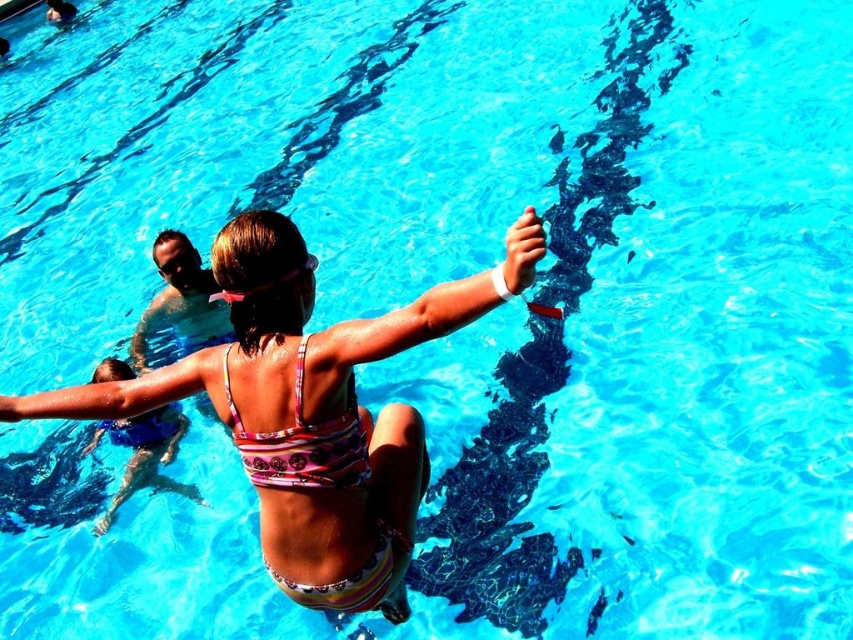
Is printed fabric bikini at center positioned at the back of printed fabric bikini top at center?

No, it is not.

Does printed fabric bikini at center appear on the left side of printed fabric bikini top at center?

In fact, printed fabric bikini at center is to the right of printed fabric bikini top at center.

Identify the location of printed fabric bikini at center. (305, 444).

Between printed fabric bikini top at center and multicolored striped swimsuit at center, which one is positioned higher?

printed fabric bikini top at center

Which of these two, printed fabric bikini top at center or multicolored striped swimsuit at center, stands taller?

Standing taller between the two is multicolored striped swimsuit at center.

Does point (282, 442) come behind point (115, 499)?

No, it is in front of (115, 499).

Where is `printed fabric bikini top at center`? The width and height of the screenshot is (853, 640). printed fabric bikini top at center is located at coordinates (303, 442).

What do you see at coordinates (312, 406) in the screenshot?
I see `pink fabric bikini at center` at bounding box center [312, 406].

Is pink fabric bikini at center closer to the viewer compared to multicolored striped swimsuit at center?

Yes, it is.

Where is `pink fabric bikini at center`? The width and height of the screenshot is (853, 640). pink fabric bikini at center is located at coordinates (312, 406).